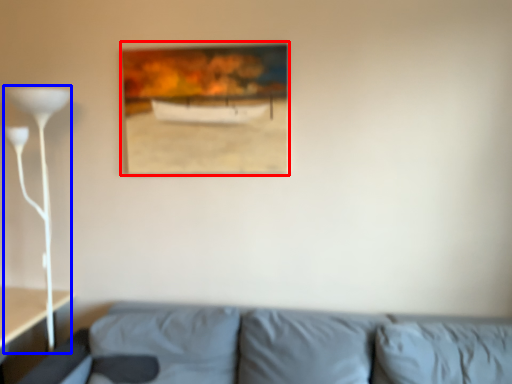
Question: Among these objects, which one is farthest to the camera, picture frame (highlighted by a red box) or table lamp (highlighted by a blue box)?

Choices:
 (A) picture frame
 (B) table lamp

Answer: (A)